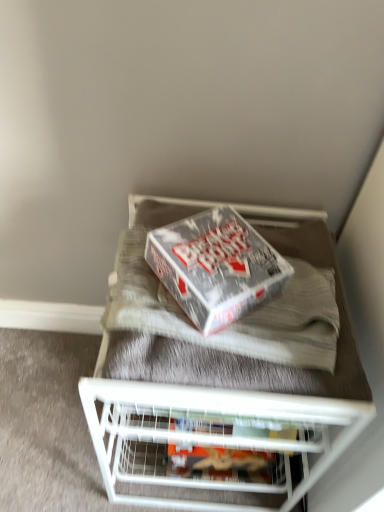
Measure the distance between silver metallic box at center and camera.

silver metallic box at center is 70.72 centimeters from camera.

What is the approximate width of white metal shelf at upper center?

white metal shelf at upper center is 21.20 inches in width.

In order to face white wire shelf at center, should I rotate leftwards or rightwards?

Rotate your view left by about 4.532°.

This screenshot has height=512, width=384. What are the coordinates of `silver metallic box at center` in the screenshot? It's located at (216, 267).

From the image's perspective, between silver metallic box at center and white wire shelf at center, who is located below?

white wire shelf at center is shown below in the image.

From a real-world perspective, between silver metallic box at center and white wire shelf at center, who is vertically higher?

silver metallic box at center.

Is silver metallic box at center positioned with its back to white wire shelf at center?

silver metallic box at center does not have its back to white wire shelf at center.

How many degrees apart are the facing directions of silver metallic box at center and white wire shelf at center?

The angle between the facing direction of silver metallic box at center and the facing direction of white wire shelf at center is 127 degrees.

Is white wire shelf at center oriented towards matte cardboard box at center?

No, white wire shelf at center is not aimed at matte cardboard box at center.

Between white wire shelf at center and matte cardboard box at center, which one appears on the right side from the viewer's perspective?

From the viewer's perspective, matte cardboard box at center appears more on the right side.

Can you confirm if white wire shelf at center is thinner than matte cardboard box at center?

No.

Image resolution: width=384 pixels, height=512 pixels. In order to click on shelf that is under the matte cardboard box at center (from a real-world perspective) in this screenshot , I will do pos(207,436).

Does point (216, 446) appear closer or farther from the camera than point (302, 430)?

Point (216, 446) appears to be farther away from the viewer than point (302, 430).

Who is more distant, matte cardboard box at center or white wire shelf at center?

Positioned behind is white wire shelf at center.

From a real-world perspective, is matte cardboard box at center positioned above or below white wire shelf at center?

matte cardboard box at center is above white wire shelf at center.

From their relative heights in the image, would you say matte cardboard box at center is taller or shorter than white wire shelf at center?

In the image, matte cardboard box at center appears to be taller than white wire shelf at center.

Does silver metallic box at center have a larger size compared to matte cardboard box at center?

Incorrect, silver metallic box at center is not larger than matte cardboard box at center.

Is matte cardboard box at center at the back of silver metallic box at center?

No, matte cardboard box at center is not at the back of silver metallic box at center.

Would you say silver metallic box at center is to the left or to the right of matte cardboard box at center in the picture?

Based on their positions, silver metallic box at center is located to the left of matte cardboard box at center.

Considering the relative positions of white wire shelf at center and white metal shelf at upper center in the image provided, is white wire shelf at center to the right of white metal shelf at upper center from the viewer's perspective?

Incorrect, white wire shelf at center is not on the right side of white metal shelf at upper center.

Who is taller, white wire shelf at center or white metal shelf at upper center?

white metal shelf at upper center.

Where is `shelf below the white metal shelf at upper center (from the image's perspective)`? shelf below the white metal shelf at upper center (from the image's perspective) is located at coordinates (207, 436).

Which is closer to the camera, (302, 406) or (165, 245)?

Positioned in front is point (302, 406).

Considering the relative sizes of white metal shelf at upper center and silver metallic box at center in the image provided, is white metal shelf at upper center shorter than silver metallic box at center?

Incorrect, the height of white metal shelf at upper center does not fall short of that of silver metallic box at center.

From a real-world perspective, which object stands above the other?

silver metallic box at center.

Can we say silver metallic box at center lies outside white metal shelf at upper center?

Yes, silver metallic box at center is located beyond the bounds of white metal shelf at upper center.

Which is closer to the camera, [230,297] or [322,252]?

The point [230,297] is more forward.

Does silver metallic box at center turn towards white metal shelf at upper center?

No, silver metallic box at center is not facing towards white metal shelf at upper center.

What are the coordinates of `shelf behind the silver metallic box at center` in the screenshot? It's located at (207, 436).

At what (x,y) coordinates should I click in order to perform the action: click on package on the right of white wire shelf at center. Please return your answer as a coordinate pair (x, y). This screenshot has width=384, height=512. Looking at the image, I should click on (224, 464).

Which object lies nearer to the anchor point matte cardboard box at center, silver metallic box at center or white wire shelf at center?

white wire shelf at center is closer to matte cardboard box at center.

When comparing their distances from white metal shelf at upper center, does silver metallic box at center or matte cardboard box at center seem further?

silver metallic box at center is positioned further to the anchor white metal shelf at upper center.

Considering their positions, is silver metallic box at center positioned closer to white metal shelf at upper center than white wire shelf at center?

white wire shelf at center lies closer to white metal shelf at upper center than the other object.

Looking at this image, from the image, which object appears to be nearer to silver metallic box at center, white wire shelf at center or matte cardboard box at center?

Among the two, white wire shelf at center is located nearer to silver metallic box at center.

From the picture: Which object lies further to the anchor point white wire shelf at center, white metal shelf at upper center or matte cardboard box at center?

Among the two, matte cardboard box at center is located further to white wire shelf at center.

When comparing their distances from matte cardboard box at center, does white metal shelf at upper center or silver metallic box at center seem closer?

white metal shelf at upper center.

Based on their spatial positions, is silver metallic box at center or white metal shelf at upper center closer to white wire shelf at center?

white metal shelf at upper center is positioned closer to the anchor white wire shelf at center.

When comparing their distances from matte cardboard box at center, does silver metallic box at center or white metal shelf at upper center seem closer?

white metal shelf at upper center lies closer to matte cardboard box at center than the other object.

Locate an element on the screen. furniture between silver metallic box at center and white wire shelf at center along the z-axis is located at coordinates (228, 404).

Locate an element on the screen. furniture between silver metallic box at center and matte cardboard box at center in the vertical direction is located at coordinates (228, 404).

Where is `package between white metal shelf at upper center and white wire shelf at center along the z-axis`? The width and height of the screenshot is (384, 512). package between white metal shelf at upper center and white wire shelf at center along the z-axis is located at coordinates (224, 464).

Where is `package between silver metallic box at center and white wire shelf at center in the vertical direction`? package between silver metallic box at center and white wire shelf at center in the vertical direction is located at coordinates (224, 464).